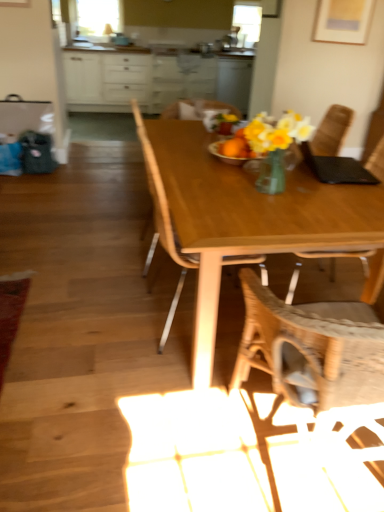
This screenshot has width=384, height=512. I want to click on blank space to the left of woven fabric chair at center, acting as the 2th chair starting from the left, so click(x=164, y=442).